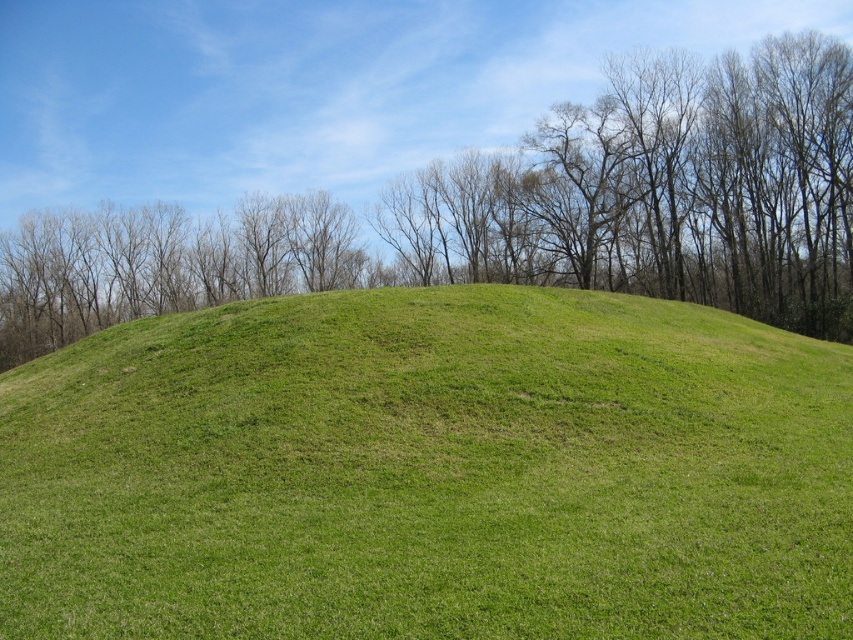
Does green grassy hill at center have a larger size compared to green grassy mound at center?

No.

Which is more to the right, green grassy hill at center or green grassy mound at center?

Positioned to the right is green grassy hill at center.

Does point (198, 490) come in front of point (849, 337)?

Yes, it is.

Locate an element on the screen. The width and height of the screenshot is (853, 640). green grassy hill at center is located at coordinates (428, 472).